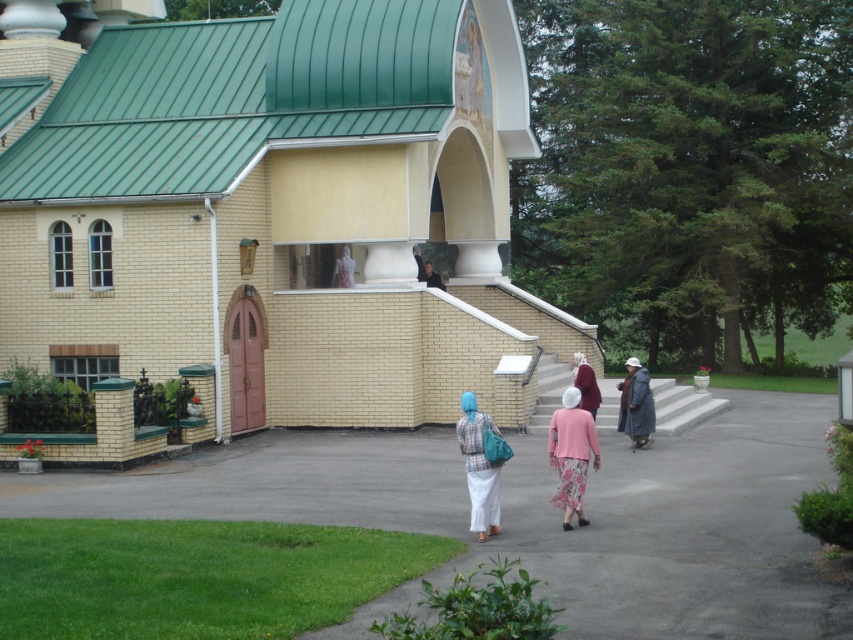
You are a visitor who wants to walk from the entrance of the building to the paved area. The entrance has a reddish brown door. You see a smooth asphalt path at center and a gray woolen coat at lower right. Which object is larger in size?

The smooth asphalt path at center is bigger than gray woolen coat at lower right, so the smooth asphalt path at center is larger in size.

You are a visitor standing in front of the yellow brick church at center and the gray woolen coat at lower right. Which object is positioned higher in the image?

The yellow brick church at center is positioned higher than the gray woolen coat at lower right according to the description.

You are standing in front of the yellow brick church at center and want to greet someone wearing the gray woolen coat at lower right. In which direction should you walk to reach them?

The yellow brick church at center is positioned on the left side of the gray woolen coat at lower right, so you should walk to the right to reach them.